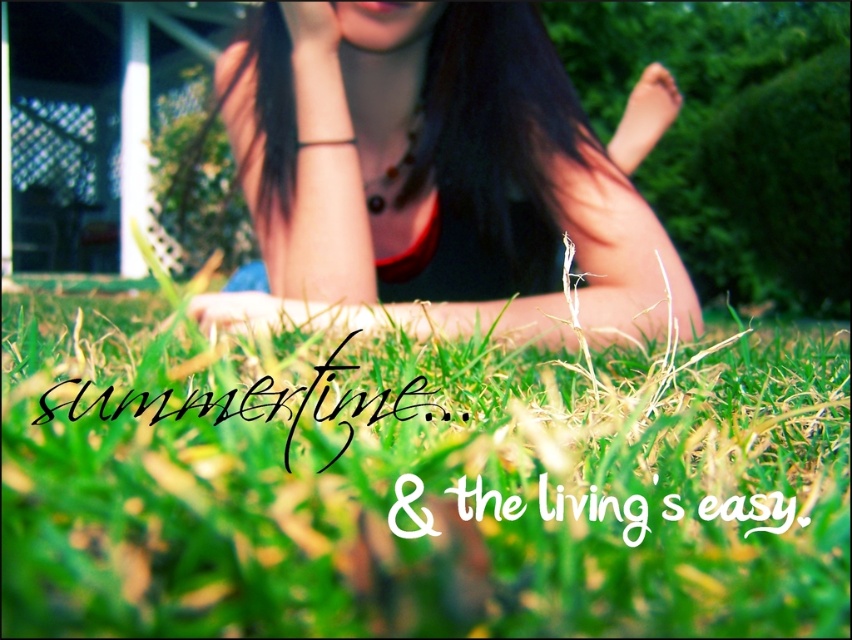
You are a photographer trying to capture a closeup of the green grass at center while avoiding the matte skin hand at upper center. Based on the scene, can you determine if the grass is tall enough to be visible behind the hand?

The green grass at center is much taller than the matte skin hand at upper center, so yes, the grass will be visible behind the hand in the closeup.

You are a photographer trying to capture the matte red tank top at center and the green grass at center in the same frame. Based on their positions, which object should you adjust your camera to focus on first to ensure both are in the frame?

The green grass at center is positioned on the left side of matte red tank top at center, so you should focus on the matte red tank top at center first to ensure both the green grass at center and the matte red tank top at center are captured in the frame.

You are a photographer trying to capture a closeup of the matte red tank top at center and the matte skin hand at upper center. Which object should you zoom in on to ensure both are in focus without moving the camera?

The matte red tank top at center is larger than the matte skin hand at upper center, so you should zoom in on the matte skin hand at upper center to ensure both are in focus without moving the camera.